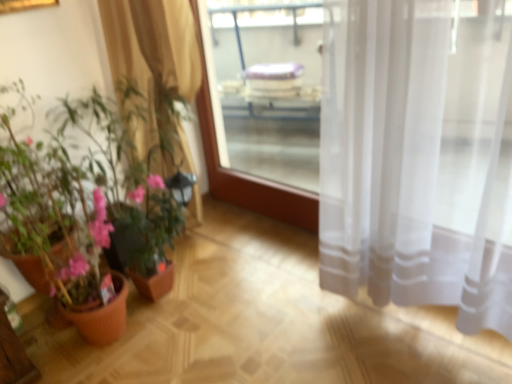
Question: Is terracotta pot plant at left completely or partially outside of beige sheer curtain at left?

Choices:
 (A) no
 (B) yes

Answer: (B)

Question: From a real-world perspective, is terracotta pot plant at left on top of beige sheer curtain at left?

Choices:
 (A) no
 (B) yes

Answer: (B)

Question: Is terracotta pot plant at left bigger than beige sheer curtain at left?

Choices:
 (A) no
 (B) yes

Answer: (B)

Question: From a real-world perspective, is terracotta pot plant at left physically below beige sheer curtain at left?

Choices:
 (A) yes
 (B) no

Answer: (B)

Question: From the image's perspective, would you say terracotta pot plant at left is positioned over beige sheer curtain at left?

Choices:
 (A) yes
 (B) no

Answer: (B)

Question: Would you say terracotta pot plant at left contains beige sheer curtain at left?

Choices:
 (A) no
 (B) yes

Answer: (A)

Question: Is terracotta pot plant at left at the left side of transparent glass window screen at center?

Choices:
 (A) yes
 (B) no

Answer: (A)

Question: Would you say terracotta pot plant at left is outside transparent glass window screen at center?

Choices:
 (A) no
 (B) yes

Answer: (B)

Question: Does terracotta pot plant at left have a greater width compared to transparent glass window screen at center?

Choices:
 (A) yes
 (B) no

Answer: (A)

Question: Does terracotta pot plant at left contain transparent glass window screen at center?

Choices:
 (A) no
 (B) yes

Answer: (A)

Question: Considering the relative sizes of terracotta pot plant at left and transparent glass window screen at center in the image provided, is terracotta pot plant at left bigger than transparent glass window screen at center?

Choices:
 (A) yes
 (B) no

Answer: (A)

Question: From a real-world perspective, is terracotta pot plant at left beneath transparent glass window screen at center?

Choices:
 (A) yes
 (B) no

Answer: (B)

Question: Is beige sheer curtain at left oriented towards transparent glass window screen at center?

Choices:
 (A) yes
 (B) no

Answer: (B)